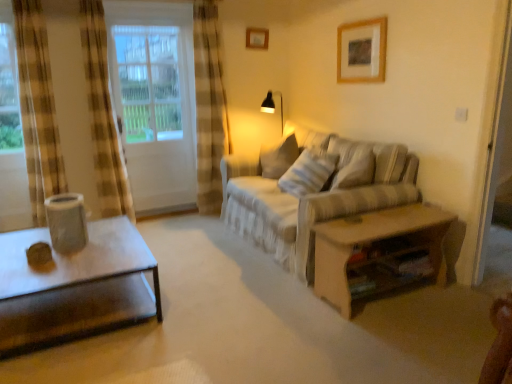
Image resolution: width=512 pixels, height=384 pixels. What are the coordinates of `free space in front of beige fabric couch at center` in the screenshot? It's located at pyautogui.click(x=303, y=331).